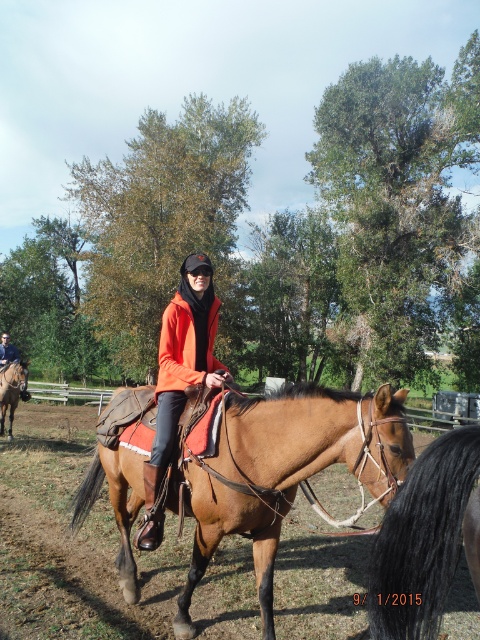
Is point (184, 340) behind point (15, 356)?

No, (184, 340) is in front of (15, 356).

Between point (156, 460) and point (12, 349), which one is positioned behind?

The point (12, 349) is more distant.

Measure the distance between orange matte jacket at center and camera.

A distance of 3.92 meters exists between orange matte jacket at center and camera.

Identify the location of orange matte jacket at center. Image resolution: width=480 pixels, height=640 pixels. (180, 376).

Is point (274, 484) positioned behind point (8, 356)?

No.

Is point (195, 579) positioned in front of point (4, 333)?

Yes, it is.

Describe the element at coordinates (285, 470) in the screenshot. I see `brown leather saddle at center` at that location.

Image resolution: width=480 pixels, height=640 pixels. I want to click on brown leather saddle at center, so click(285, 470).

Which is above, black glossy horse tail at lower right or brown leather saddle at left?

Positioned higher is black glossy horse tail at lower right.

Is black glossy horse tail at lower right positioned in front of brown leather saddle at left?

Yes, black glossy horse tail at lower right is closer to the viewer.

Between point (399, 554) and point (0, 394), which one is positioned in front?

Positioned in front is point (399, 554).

Where is `black glossy horse tail at lower right`? This screenshot has height=640, width=480. black glossy horse tail at lower right is located at coordinates [x=425, y=538].